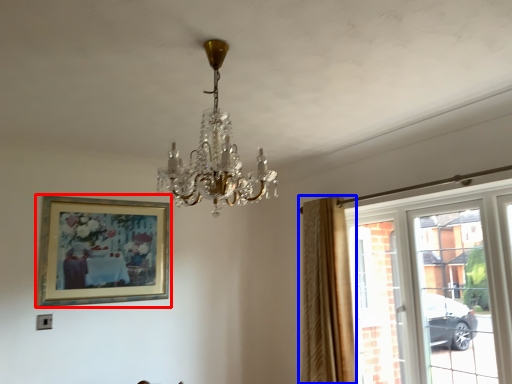
Question: Which of the following is the farthest to the observer, picture frame (highlighted by a red box) or curtain (highlighted by a blue box)?

Choices:
 (A) picture frame
 (B) curtain

Answer: (A)